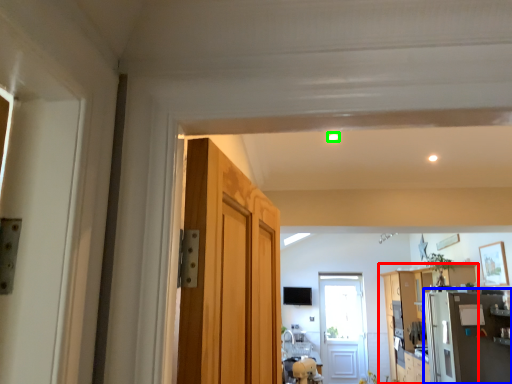
Question: Based on their relative distances, which object is nearer to cabinetry (highlighted by a red box)? Choose from appliance (highlighted by a blue box) and light (highlighted by a green box).

Choices:
 (A) appliance
 (B) light

Answer: (A)